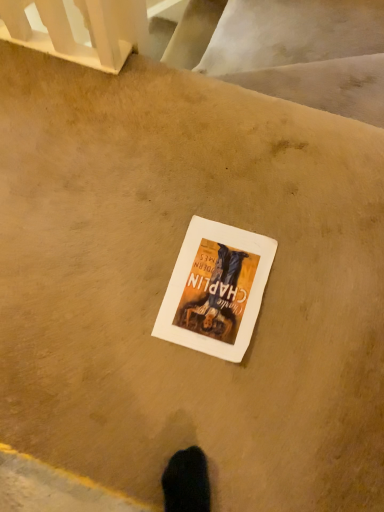
This screenshot has height=512, width=384. In order to click on free space in front of white paper at center in this screenshot , I will do `click(212, 394)`.